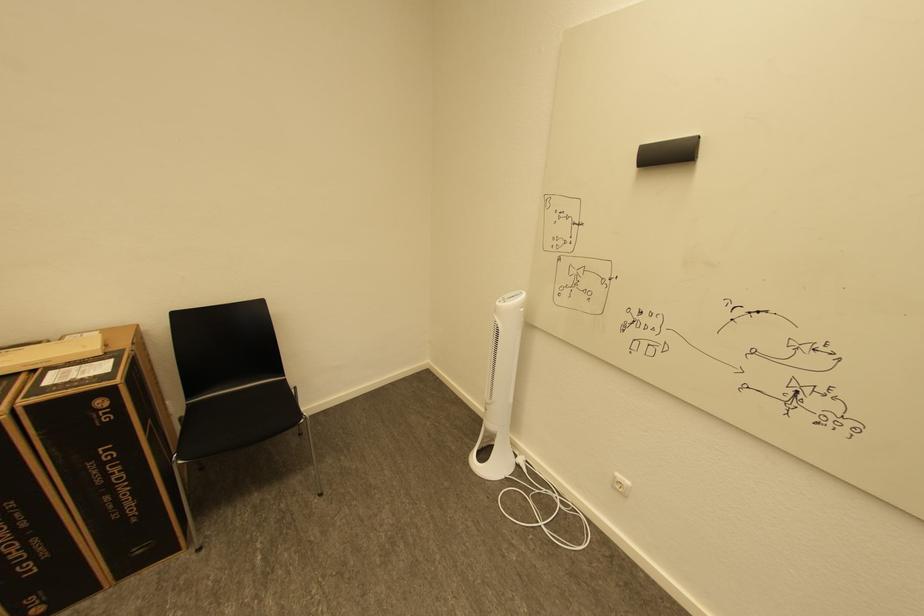
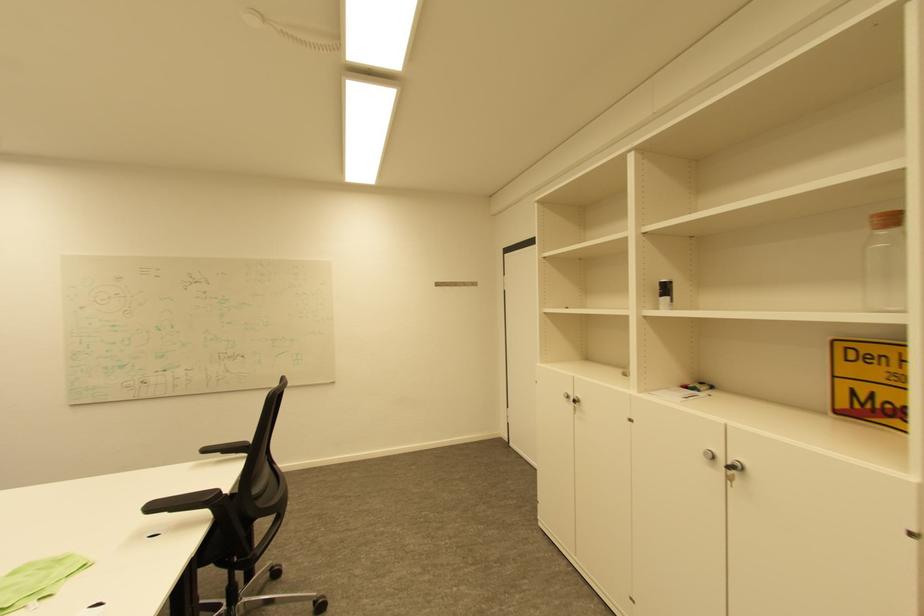
Question: Based on the continuous images, in which direction is the camera rotating? Reply with the corresponding letter.

Choices:
 (A) Left
 (B) Right
 (C) Up
 (D) Down

Answer: (A)